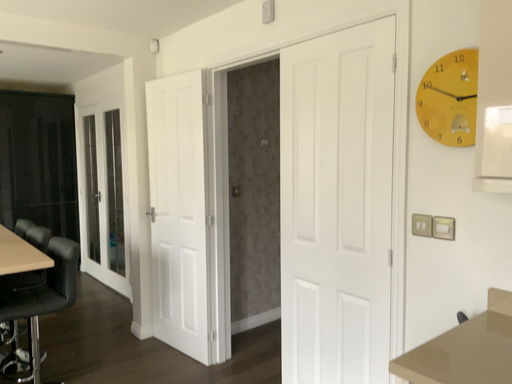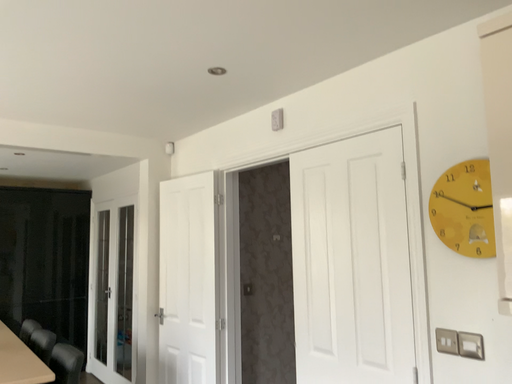
Question: Which way did the camera rotate in the video?

Choices:
 (A) rotated upward
 (B) rotated downward

Answer: (A)